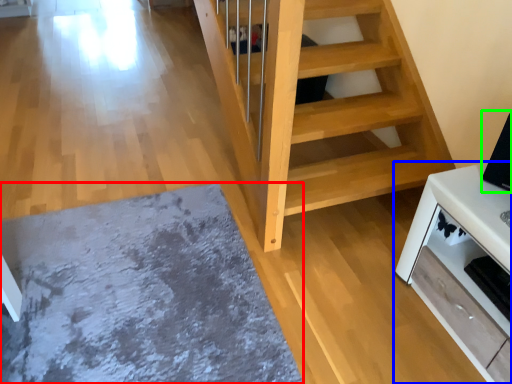
Question: Estimate the real-world distances between objects in this image. Which object is farther from mat (highlighted by a red box), furniture (highlighted by a blue box) or appliance (highlighted by a green box)?

Choices:
 (A) furniture
 (B) appliance

Answer: (B)